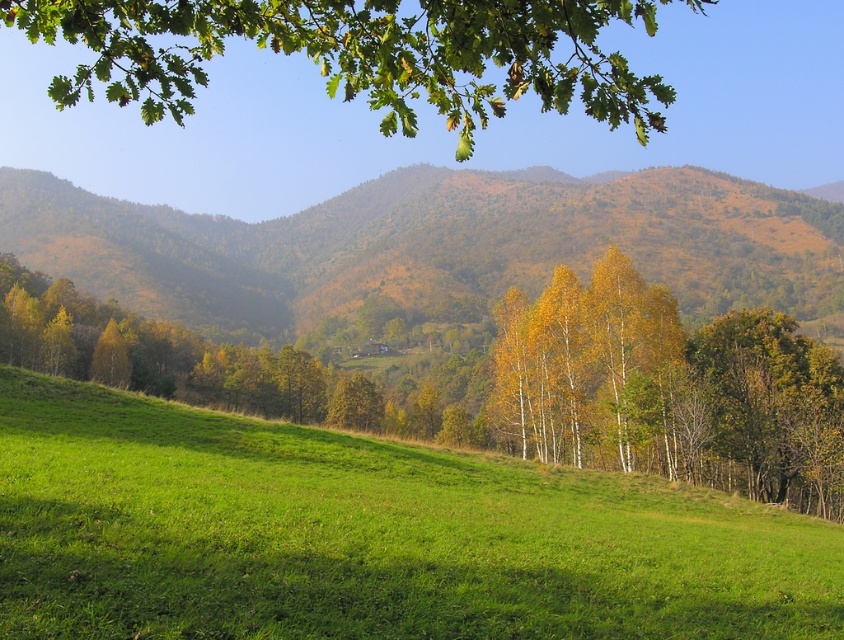
Is green grassy hillside at lower center further to camera compared to brown/wooden/mountain at center?

No.

Is point (728, 496) behind point (138, 209)?

No, (728, 496) is in front of (138, 209).

I want to click on green grassy hillside at lower center, so click(366, 536).

Can you confirm if brown/wooden/mountain at center is taller than green leafy branch at upper center?

No, brown/wooden/mountain at center is not taller than green leafy branch at upper center.

Does point (329, 252) lie behind point (116, 29)?

Yes, it is behind point (116, 29).

Where is `brown/wooden/mountain at center`? This screenshot has width=844, height=640. brown/wooden/mountain at center is located at coordinates (436, 244).

Which is behind, point (797, 259) or point (738, 356)?

Positioned behind is point (797, 259).

Locate an element on the screen. The width and height of the screenshot is (844, 640). brown/wooden/mountain at center is located at coordinates (436, 244).

This screenshot has width=844, height=640. Describe the element at coordinates (436, 244) in the screenshot. I see `brown/wooden/mountain at center` at that location.

Find the location of `brown/wooden/mountain at center`. brown/wooden/mountain at center is located at coordinates (436, 244).